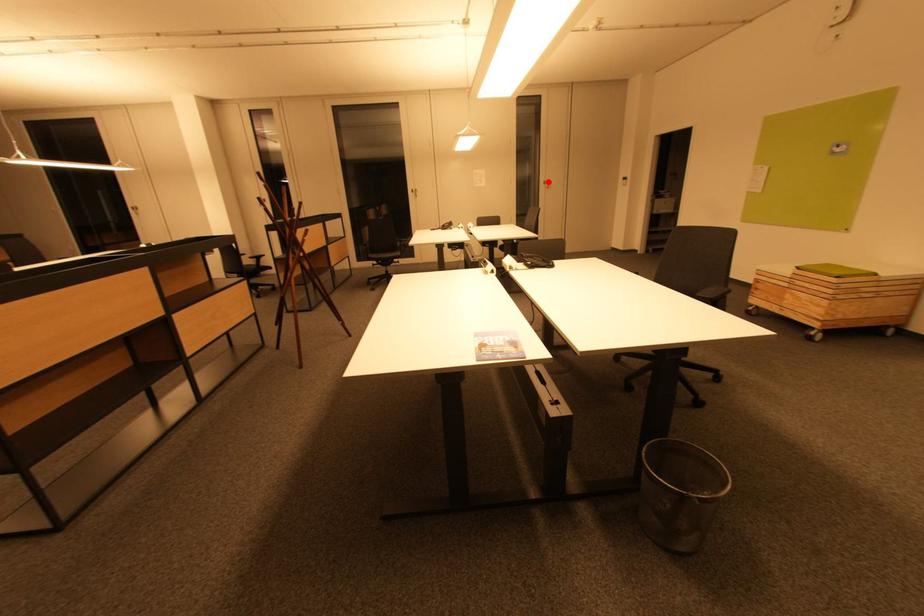
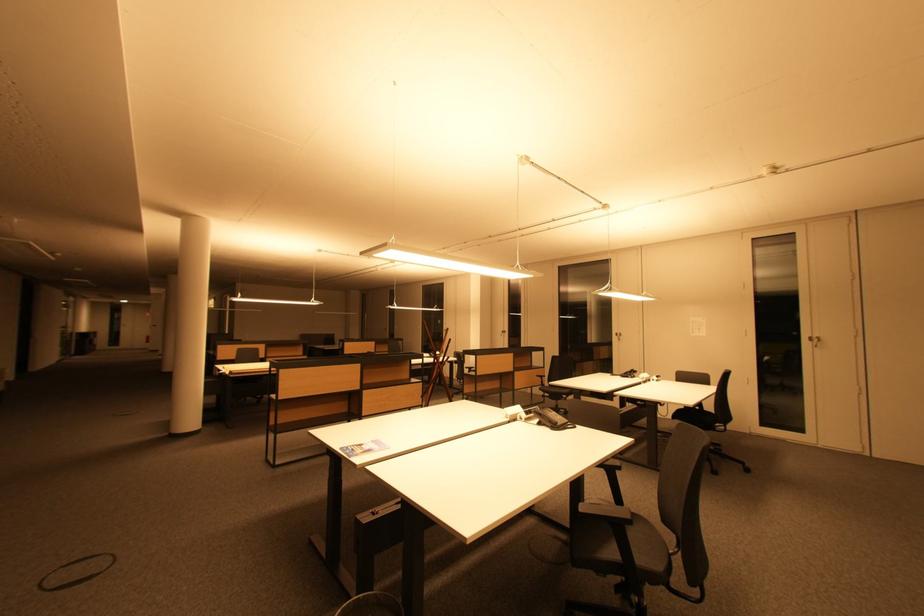
Question: I am providing you with two images of the same scene from different viewpoints. A red point is shown in image1. For the corresponding object point in image2, is it positioned nearer or farther from the camera?

Choices:
 (A) Nearer
 (B) Farther

Answer: (B)